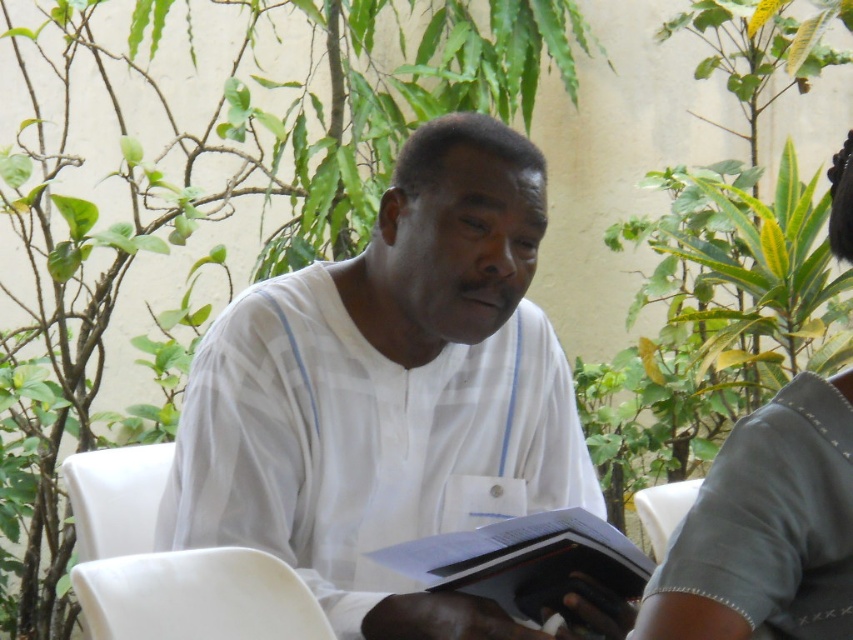
What do you see at coordinates (531, 566) in the screenshot?
I see `hardcover book at center` at bounding box center [531, 566].

Does hardcover book at center have a lesser height compared to white smooth chair at lower left?

No, hardcover book at center is not shorter than white smooth chair at lower left.

The width and height of the screenshot is (853, 640). What are the coordinates of `hardcover book at center` in the screenshot? It's located at (531, 566).

The height and width of the screenshot is (640, 853). I want to click on hardcover book at center, so click(531, 566).

Which is more to the right, white smooth chair at lower left or white plastic chair at left?

Positioned to the right is white smooth chair at lower left.

Is point (152, 600) less distant than point (128, 513)?

Yes, it is in front of point (128, 513).

This screenshot has width=853, height=640. I want to click on white smooth chair at lower left, so click(x=196, y=596).

Is gray fabric shirt at upper right below white smooth chair at lower left?

Incorrect, gray fabric shirt at upper right is not positioned below white smooth chair at lower left.

Does gray fabric shirt at upper right have a greater height compared to white smooth chair at lower left?

Indeed, gray fabric shirt at upper right has a greater height compared to white smooth chair at lower left.

Locate an element on the screen. The height and width of the screenshot is (640, 853). gray fabric shirt at upper right is located at coordinates (766, 528).